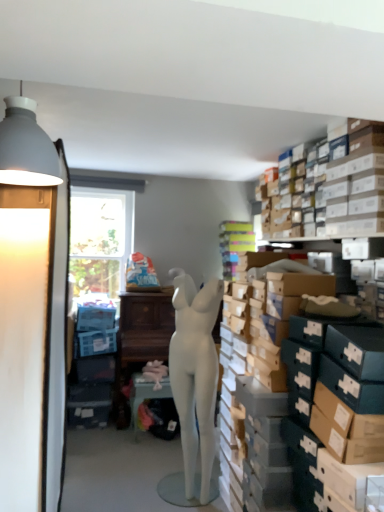
Question: From a real-world perspective, is white matte mannequin at center positioned over matte white lampshade at left based on gravity?

Choices:
 (A) no
 (B) yes

Answer: (A)

Question: Is white matte mannequin at center positioned with its back to matte white lampshade at left?

Choices:
 (A) yes
 (B) no

Answer: (B)

Question: Is white matte mannequin at center directly adjacent to matte white lampshade at left?

Choices:
 (A) no
 (B) yes

Answer: (A)

Question: Considering the relative sizes of white matte mannequin at center and matte white lampshade at left in the image provided, is white matte mannequin at center bigger than matte white lampshade at left?

Choices:
 (A) yes
 (B) no

Answer: (B)

Question: Is the depth of white matte mannequin at center greater than that of matte white lampshade at left?

Choices:
 (A) no
 (B) yes

Answer: (B)

Question: From the image's perspective, relative to white matte mannequin at center, is matte white table at center above or below?

Choices:
 (A) below
 (B) above

Answer: (A)

Question: Is matte white table at center inside or outside of white matte mannequin at center?

Choices:
 (A) outside
 (B) inside

Answer: (A)

Question: Considering the positions of matte white table at center and white matte mannequin at center in the image, is matte white table at center taller or shorter than white matte mannequin at center?

Choices:
 (A) tall
 (B) short

Answer: (B)

Question: Considering the positions of matte white table at center and white matte mannequin at center in the image, is matte white table at center bigger or smaller than white matte mannequin at center?

Choices:
 (A) small
 (B) big

Answer: (A)

Question: Would you say matte white lampshade at left is inside or outside matte white table at center?

Choices:
 (A) inside
 (B) outside

Answer: (B)

Question: From a real-world perspective, relative to matte white table at center, is matte white lampshade at left vertically above or below?

Choices:
 (A) below
 (B) above

Answer: (B)

Question: Would you say matte white lampshade at left is to the left or to the right of matte white table at center in the picture?

Choices:
 (A) left
 (B) right

Answer: (A)

Question: From the image's perspective, relative to matte white table at center, is matte white lampshade at left above or below?

Choices:
 (A) above
 (B) below

Answer: (A)

Question: Considering their positions, is matte white table at center located in front of or behind white matte lampshade at upper left?

Choices:
 (A) behind
 (B) front

Answer: (A)

Question: Looking at the image, does matte white table at center seem bigger or smaller compared to white matte lampshade at upper left?

Choices:
 (A) big
 (B) small

Answer: (A)